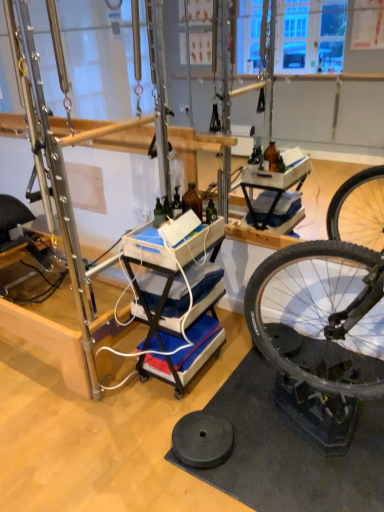
You are a GUI agent. You are given a task and a screenshot of the screen. Output one action in this format:
    pyautogui.click(x=<x>, y=<y>)
    Task: Click on the vacant space situated above wooden tray at center (from a real-world perspective)
    The width and height of the screenshot is (384, 512).
    Given the screenshot: What is the action you would take?
    pyautogui.click(x=175, y=233)